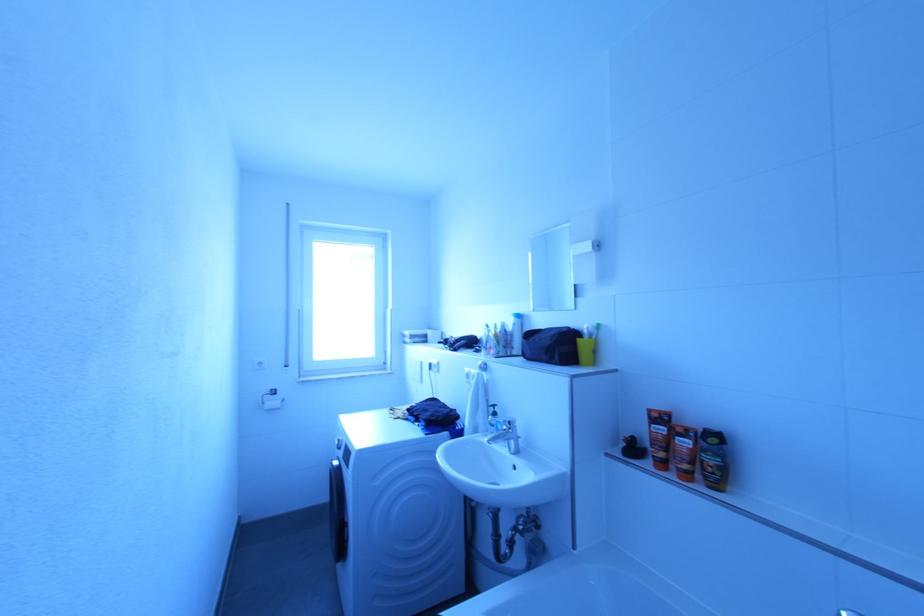
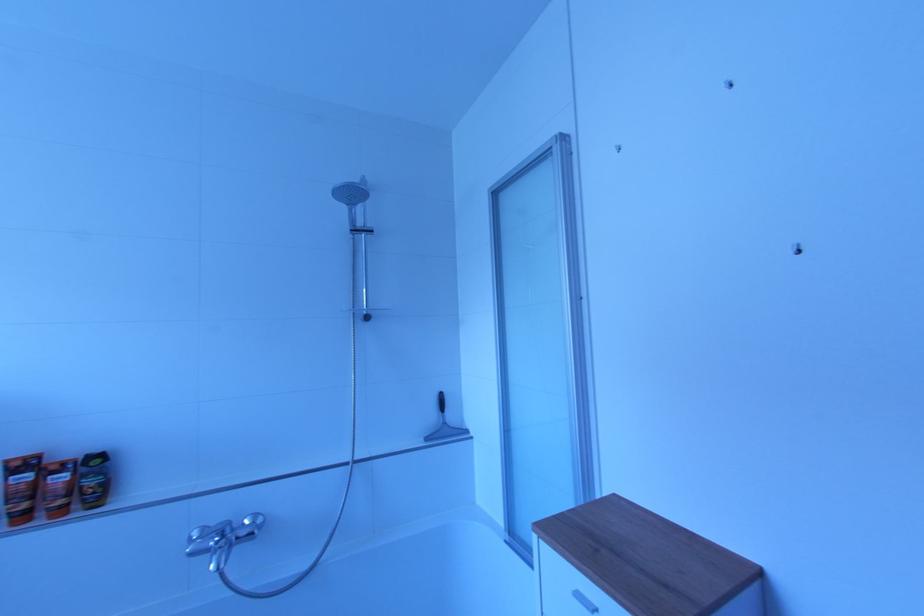
Question: The images are taken continuously from a first-person perspective. In which direction is your viewpoint rotating?

Choices:
 (A) Left
 (B) Right
 (C) Up
 (D) Down

Answer: (B)